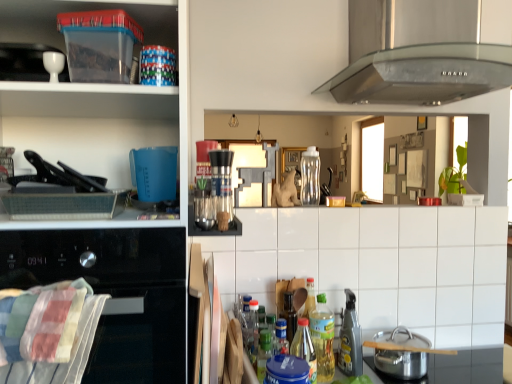
Question: In the image, is stainless steel pot at lower right on the left side or the right side of translucent plastic bottle at center, which is the 3th bottle in back-to-front order?

Choices:
 (A) left
 (B) right

Answer: (B)

Question: Considering the positions of stainless steel pot at lower right and translucent plastic bottle at center, which ranks as the first bottle in front-to-back order, in the image, is stainless steel pot at lower right taller or shorter than translucent plastic bottle at center, which ranks as the first bottle in front-to-back order,?

Choices:
 (A) short
 (B) tall

Answer: (A)

Question: Based on their relative distances, which object is nearer to the translucent plastic bottle at lower center, placed as the second bottle when sorted from top to bottom?

Choices:
 (A) stainless steel pot at lower right
 (B) white glossy cup at upper left, placed as the 2th appliance when sorted from right to left
 (C) transparent plastic container at upper left, which ranks as the first shelf in left-to-right order
 (D) black glass oven at left, the 2th home appliance when ordered from top to bottom
 (E) clear plastic bottle at center, the 3th bottle positioned from the bottom

Answer: (A)

Question: Which object is positioned farthest from the black glass oven at left, the first home appliance from the bottom?

Choices:
 (A) white tile at center, the first shelf positioned from the right
 (B) white glossy cup at upper left, which is the 2th appliance in back-to-front order
 (C) translucent plastic bottle at center, which is the first bottle in bottom-to-top order
 (D) stainless steel pot at lower right
 (E) transparent plastic container at upper left, acting as the second shelf starting from the left

Answer: (D)